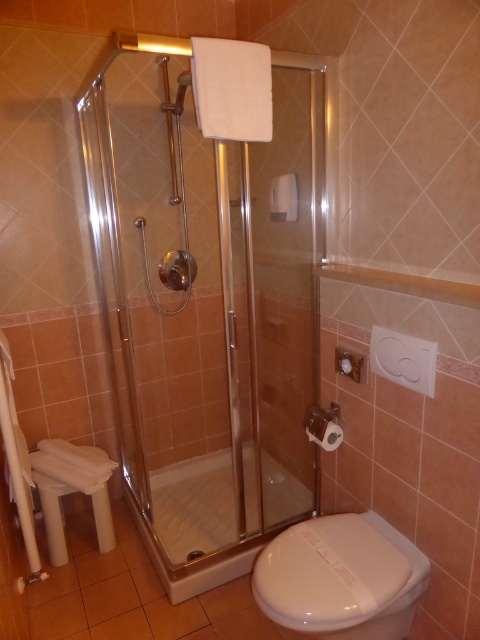
Is clear glass shower door at center further to camera compared to white plastic stool at lower left?

No, it is in front of white plastic stool at lower left.

The height and width of the screenshot is (640, 480). What do you see at coordinates (205, 305) in the screenshot?
I see `clear glass shower door at center` at bounding box center [205, 305].

Locate an element on the screen. Image resolution: width=480 pixels, height=640 pixels. clear glass shower door at center is located at coordinates (205, 305).

Is transparent glass shower at lower center above white plastic stool at lower left?

Incorrect, transparent glass shower at lower center is not positioned above white plastic stool at lower left.

The height and width of the screenshot is (640, 480). In order to click on transparent glass shower at lower center in this screenshot , I will do `click(214, 516)`.

What do you see at coordinates (214, 516) in the screenshot? I see `transparent glass shower at lower center` at bounding box center [214, 516].

Identify the location of transparent glass shower at lower center. The height and width of the screenshot is (640, 480). (214, 516).

Between clear glass shower door at center and transparent glass shower at lower center, which one is positioned lower?

transparent glass shower at lower center is below.

Which is behind, point (124, 118) or point (275, 520)?

Positioned behind is point (275, 520).

Who is more forward, (x=222, y=442) or (x=263, y=492)?

Positioned in front is point (x=263, y=492).

In order to click on clear glass shower door at center in this screenshot , I will do `click(205, 305)`.